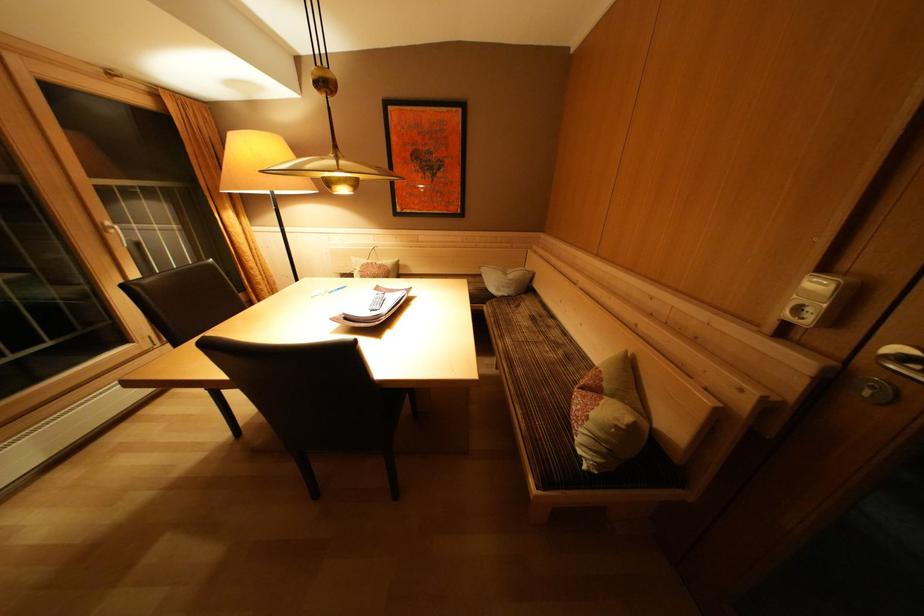
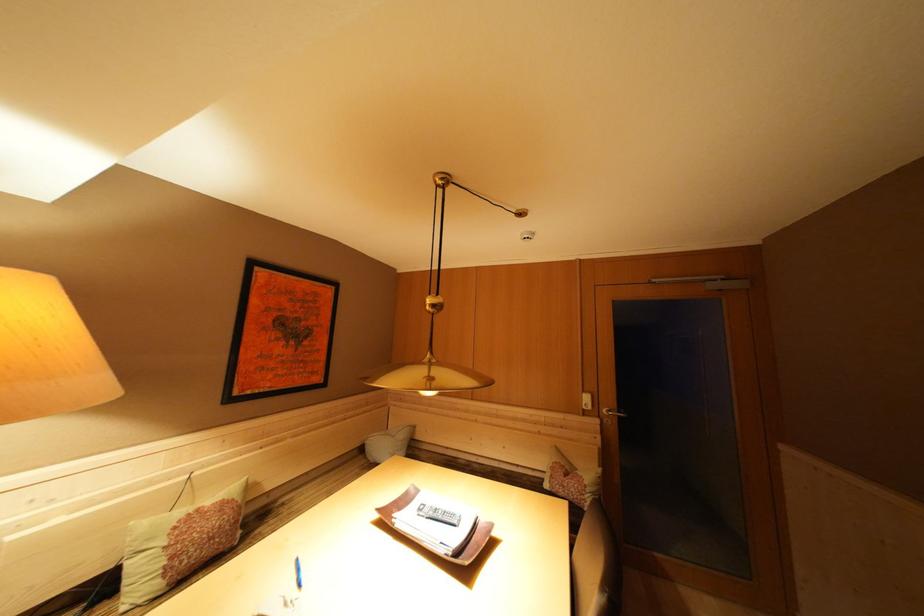
The point at (831, 275) is marked in the first image. Where is the corresponding point in the second image?

(590, 397)